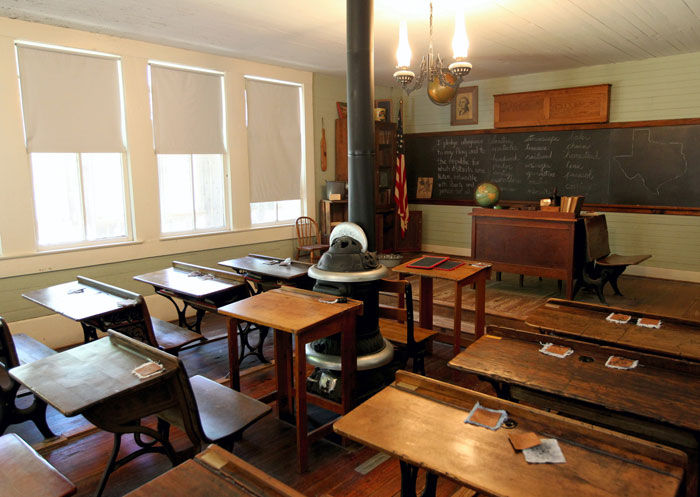
Find the location of a particular element. desk is located at coordinates (105, 372).